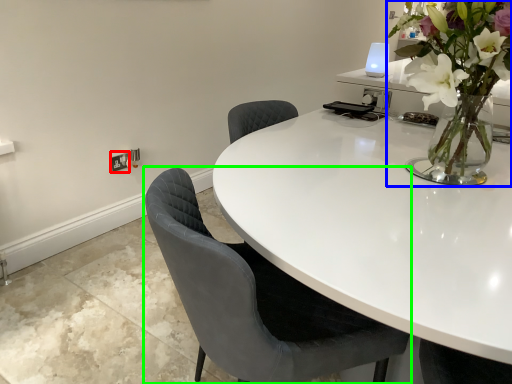
Question: Based on their relative distances, which object is nearer to electric outlet (highlighted by a red box)? Choose from houseplant (highlighted by a blue box) and chair (highlighted by a green box).

Choices:
 (A) houseplant
 (B) chair

Answer: (B)